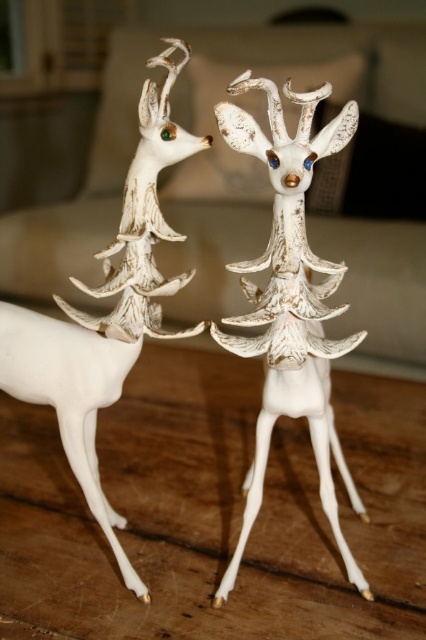
Question: Does white matte deer at center appear on the left side of white porcelain deer at center?

Choices:
 (A) no
 (B) yes

Answer: (A)

Question: Which of the following is the farthest from the observer?

Choices:
 (A) (313, 355)
 (B) (124, 333)

Answer: (A)

Question: From the image, what is the correct spatial relationship of white matte deer at center in relation to white porcelain deer at center?

Choices:
 (A) right
 (B) left

Answer: (A)

Question: Which object is farther from the camera taking this photo?

Choices:
 (A) white matte deer at center
 (B) white porcelain deer at center

Answer: (B)

Question: Which of the following is the closest to the observer?

Choices:
 (A) (114, 246)
 (B) (356, 339)

Answer: (B)

Question: In this image, where is white matte deer at center located relative to white porcelain deer at center?

Choices:
 (A) right
 (B) left

Answer: (A)